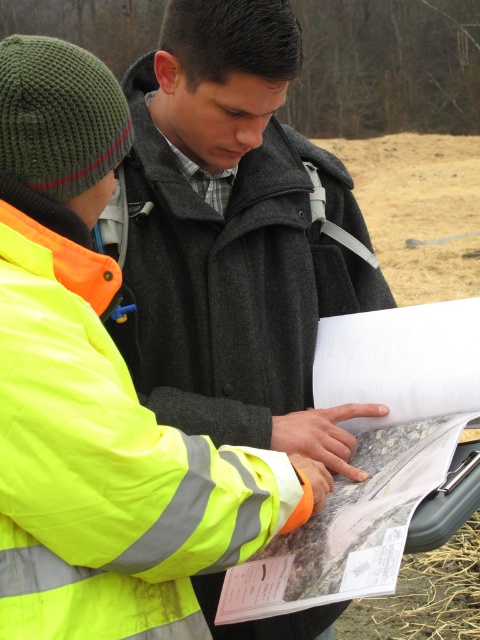
Can you confirm if neon yellow reflective jacket at left is taller than white paper at center?

Correct, neon yellow reflective jacket at left is much taller as white paper at center.

Measure the distance between neon yellow reflective jacket at left and camera.

neon yellow reflective jacket at left and camera are 35.33 inches apart from each other.

Locate an element on the screen. The image size is (480, 640). neon yellow reflective jacket at left is located at coordinates (96, 394).

Is neon yellow reflective jacket at left wider than matte gray coat at center?

No, neon yellow reflective jacket at left is not wider than matte gray coat at center.

You are a GUI agent. You are given a task and a screenshot of the screen. Output one action in this format:
    pyautogui.click(x=<x>, y=<y>)
    Task: Click on the neon yellow reflective jacket at left
    Image resolution: width=480 pixels, height=640 pixels.
    Given the screenshot: What is the action you would take?
    pyautogui.click(x=96, y=394)

Can you confirm if matte gray coat at center is thinner than white paper at center?

Incorrect, matte gray coat at center's width is not less than white paper at center's.

Is matte gray coat at center to the left of white paper at center from the viewer's perspective?

Indeed, matte gray coat at center is positioned on the left side of white paper at center.

Is point (170, 280) farther from camera compared to point (317, 385)?

That is False.

What are the coordinates of `matte gray coat at center` in the screenshot? It's located at (232, 278).